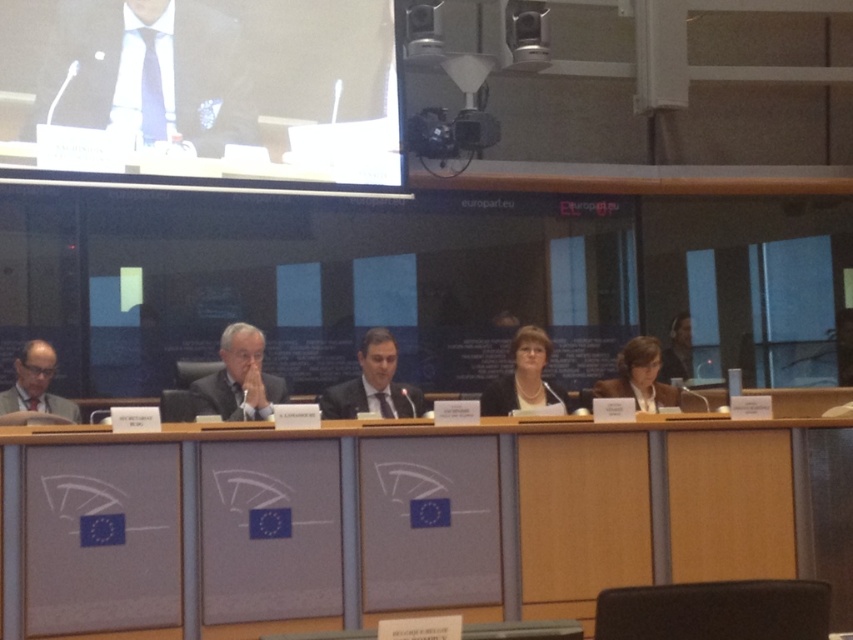
Is matte black suit at left closer to camera compared to dark brown leather jacket at lower right?

Yes, matte black suit at left is closer to the viewer.

Find the location of `matte black suit at left`. matte black suit at left is located at coordinates (36, 385).

You are a GUI agent. You are given a task and a screenshot of the screen. Output one action in this format:
    pyautogui.click(x=<x>, y=<y>)
    Task: Click on the matte black suit at left
    Image resolution: width=853 pixels, height=640 pixels.
    Given the screenshot: What is the action you would take?
    pyautogui.click(x=36, y=385)

Can you confirm if dark suit at center is positioned above light brown wood chair at center?

Incorrect, dark suit at center is not positioned above light brown wood chair at center.

The height and width of the screenshot is (640, 853). What are the coordinates of `dark suit at center` in the screenshot? It's located at (373, 385).

Does light brown wood chair at center have a larger size compared to dark brown leather jacket at lower right?

Correct, light brown wood chair at center is larger in size than dark brown leather jacket at lower right.

Who is more forward, (671,387) or (674,342)?

Point (671,387)

In order to click on light brown wood chair at center in this screenshot , I will do `click(639, 376)`.